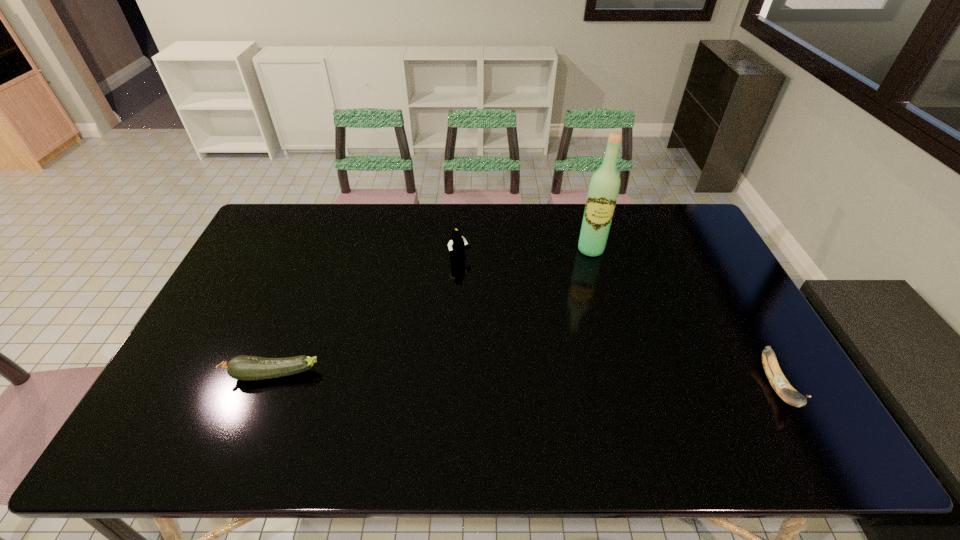
Where is `object that is the closest one to the third object from right to left`? This screenshot has width=960, height=540. object that is the closest one to the third object from right to left is located at coordinates (604, 186).

Where is `vacant space that satisfies the following two spatial constraints: 1. on the back side of the third object from right to left; 2. on the left side of the second object from right to left`? The width and height of the screenshot is (960, 540). vacant space that satisfies the following two spatial constraints: 1. on the back side of the third object from right to left; 2. on the left side of the second object from right to left is located at coordinates (461, 249).